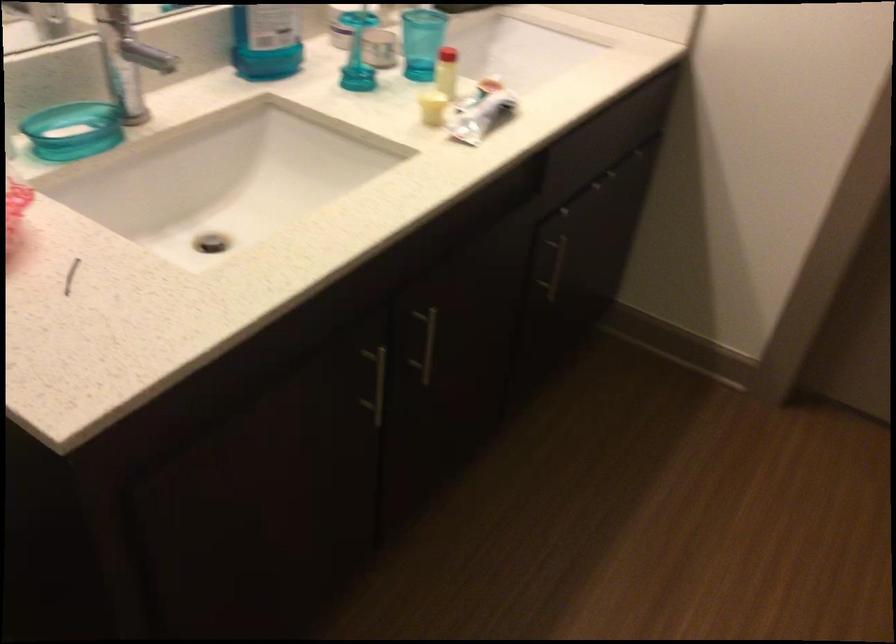
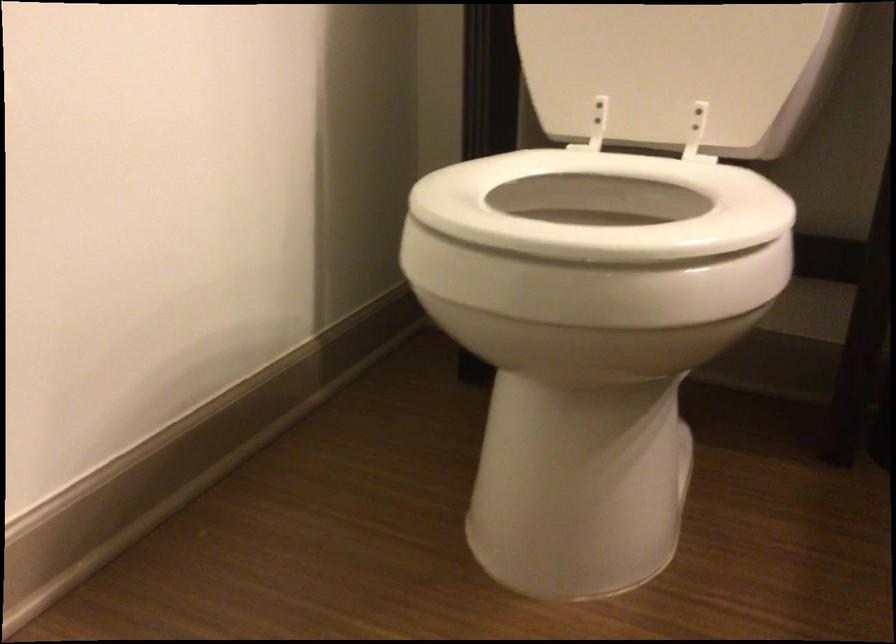
Question: Based on the continuous images, in which direction is the camera rotating? Reply with the corresponding letter.

Choices:
 (A) Left
 (B) Right
 (C) Up
 (D) Down

Answer: (A)